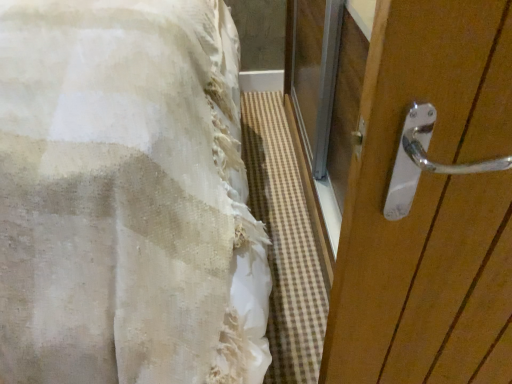
Question: Is white textured fabric at left not within polished wood door handle at right?

Choices:
 (A) no
 (B) yes

Answer: (B)

Question: Can you confirm if white textured fabric at left is taller than polished wood door handle at right?

Choices:
 (A) no
 (B) yes

Answer: (B)

Question: Is polished wood door handle at right a part of white textured fabric at left?

Choices:
 (A) no
 (B) yes

Answer: (A)

Question: Is white textured fabric at left smaller than polished wood door handle at right?

Choices:
 (A) no
 (B) yes

Answer: (A)

Question: Does white textured fabric at left lie in front of polished wood door handle at right?

Choices:
 (A) no
 (B) yes

Answer: (B)

Question: Is white textured fabric at left not close to polished wood door handle at right?

Choices:
 (A) no
 (B) yes

Answer: (A)

Question: Considering the relative sizes of polished wood door handle at right and white textured fabric at left in the image provided, is polished wood door handle at right smaller than white textured fabric at left?

Choices:
 (A) yes
 (B) no

Answer: (A)

Question: From the image's perspective, would you say polished wood door handle at right is positioned over white textured fabric at left?

Choices:
 (A) no
 (B) yes

Answer: (B)

Question: Could you tell me if polished wood door handle at right is turned towards white textured fabric at left?

Choices:
 (A) no
 (B) yes

Answer: (B)

Question: Does polished wood door handle at right appear on the left side of white textured fabric at left?

Choices:
 (A) yes
 (B) no

Answer: (B)

Question: From a real-world perspective, is polished wood door handle at right over white textured fabric at left?

Choices:
 (A) yes
 (B) no

Answer: (B)

Question: Is polished wood door handle at right facing away from white textured fabric at left?

Choices:
 (A) yes
 (B) no

Answer: (B)

Question: In the image, is white textured fabric at left positioned in front of or behind polished wood door handle at right?

Choices:
 (A) behind
 (B) front

Answer: (B)